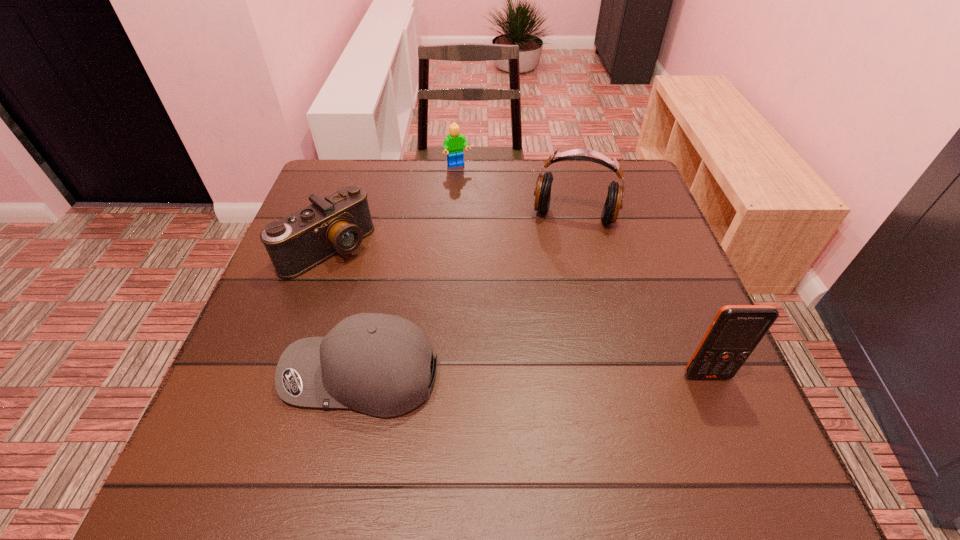
Image resolution: width=960 pixels, height=540 pixels. Find the location of `vacant space at the far left corner of the desktop`. vacant space at the far left corner of the desktop is located at coordinates (326, 183).

What are the coordinates of `blank space at the near left corner` in the screenshot? It's located at (296, 418).

At what (x,y) coordinates should I click in order to perform the action: click on vacant region between the Lego and the camera. Please return your answer as a coordinate pair (x, y). The width and height of the screenshot is (960, 540). Looking at the image, I should click on (393, 207).

The image size is (960, 540). What are the coordinates of `free space that is in between the rightmost object and the Lego` in the screenshot? It's located at (583, 271).

This screenshot has width=960, height=540. Identify the location of free space between the baseball cap and the headset. (468, 295).

Image resolution: width=960 pixels, height=540 pixels. I want to click on vacant space in between the second object from right to left and the farthest object, so click(x=516, y=191).

The height and width of the screenshot is (540, 960). In order to click on free area in between the camera and the headset in this screenshot , I will do click(x=451, y=232).

The height and width of the screenshot is (540, 960). What are the coordinates of `free point between the camera and the rightmost object` in the screenshot? It's located at (517, 312).

The image size is (960, 540). Identify the location of unoccupied area between the cellular telephone and the baseball cap. (534, 375).

What are the coordinates of `free spot between the camera and the fourth object from left to right` in the screenshot? It's located at (451, 232).